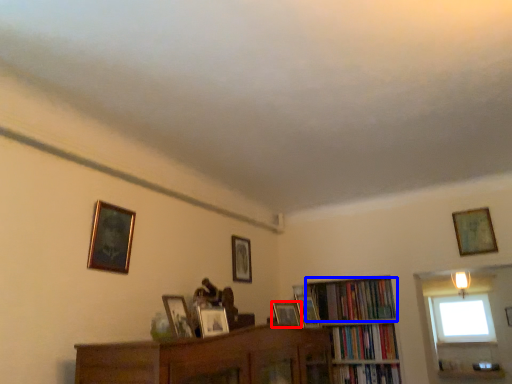
Question: Among these objects, which one is farthest to the camera, picture frame (highlighted by a red box) or book (highlighted by a blue box)?

Choices:
 (A) picture frame
 (B) book

Answer: (B)